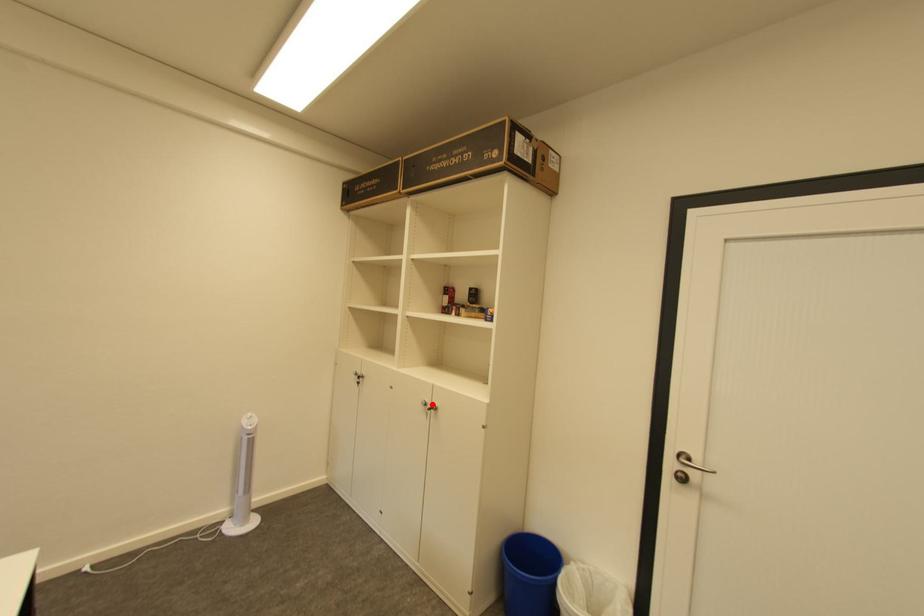
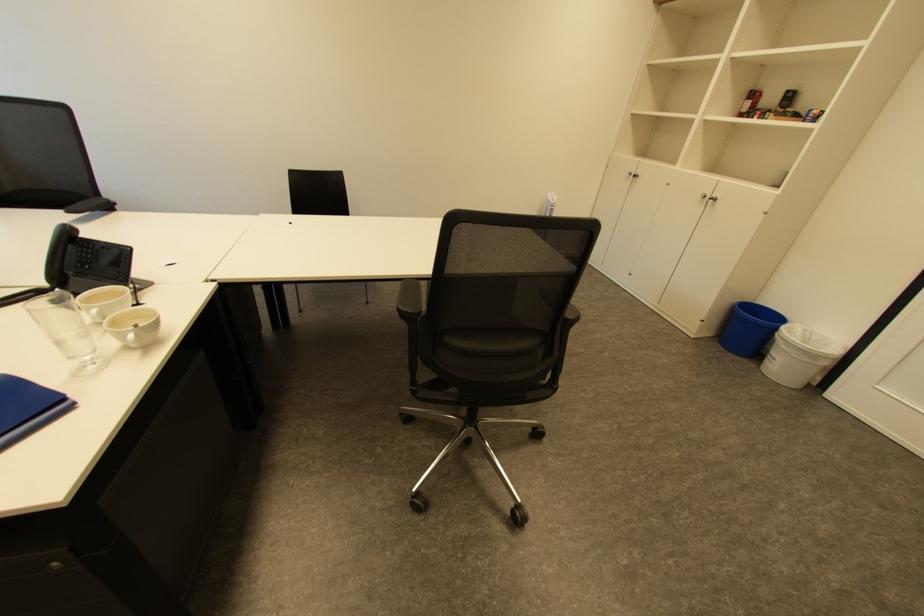
Where in the second image is the point corresponding to the highlighted location from the first image?

(711, 196)